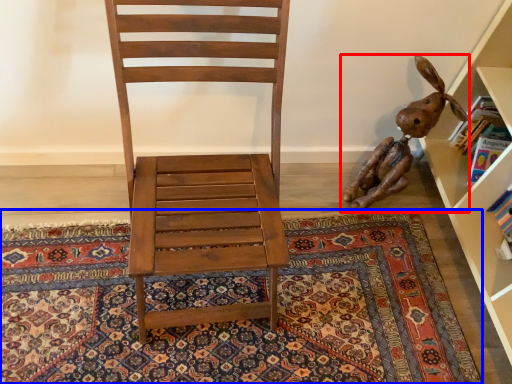
Question: Which of the following is the closest to the observer, toy (highlighted by a red box) or mat (highlighted by a blue box)?

Choices:
 (A) toy
 (B) mat

Answer: (B)